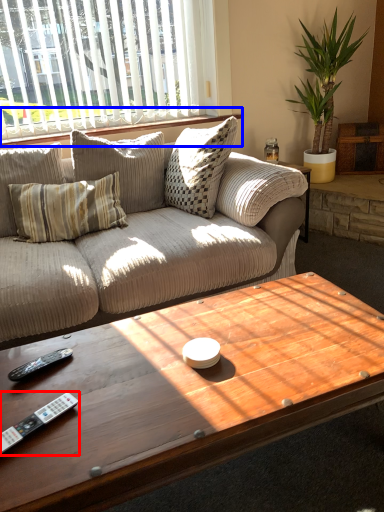
Question: Which object appears farthest to the camera in this image, control (highlighted by a red box) or window sill (highlighted by a blue box)?

Choices:
 (A) control
 (B) window sill

Answer: (B)